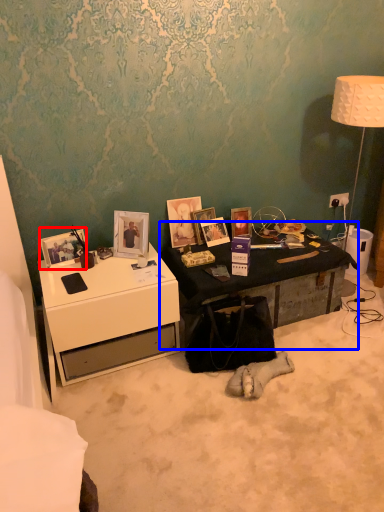
Question: Which object is further to the camera taking this photo, picture frame (highlighted by a red box) or table (highlighted by a blue box)?

Choices:
 (A) picture frame
 (B) table

Answer: (B)